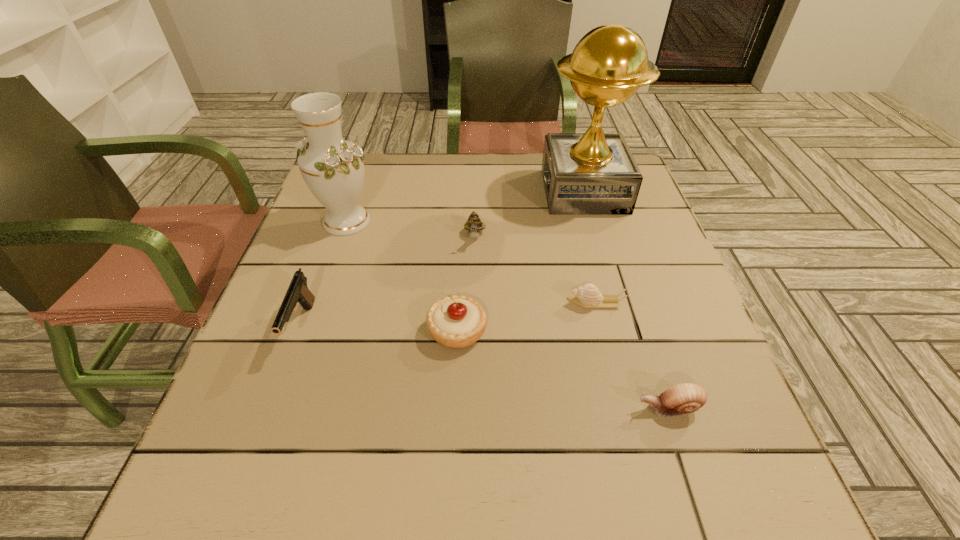
Image resolution: width=960 pixels, height=540 pixels. In order to click on vacant space located 0.270m on the front-facing side of the tallest object in this screenshot , I will do `click(443, 191)`.

This screenshot has width=960, height=540. Identify the location of blank space located on the front-facing side of the tallest object. (465, 191).

This screenshot has height=540, width=960. In order to click on free space located on the front-facing side of the tallest object in this screenshot , I will do `click(398, 191)`.

This screenshot has height=540, width=960. In order to click on vacant position located 0.170m on the right of the second tallest object in this screenshot , I will do `click(446, 221)`.

Locate an element on the screen. free space located 0.110m on the face of the tallest escargot is located at coordinates (474, 285).

You are a GUI agent. You are given a task and a screenshot of the screen. Output one action in this format:
    pyautogui.click(x=<x>, y=<y>)
    Task: Click on the vacant space located 0.160m at the muzzle of the pistol
    
    Given the screenshot: What is the action you would take?
    pyautogui.click(x=259, y=444)

Where is `vacant space located on the left of the pastry`? vacant space located on the left of the pastry is located at coordinates (268, 330).

Locate an element on the screen. The image size is (960, 540). vacant space located 0.180m on the front-facing side of the second shortest object is located at coordinates (529, 408).

Where is `free space located 0.080m on the front-facing side of the second shortest object`? The image size is (960, 540). free space located 0.080m on the front-facing side of the second shortest object is located at coordinates (588, 408).

The width and height of the screenshot is (960, 540). I want to click on vacant position located on the front-facing side of the second shortest object, so click(499, 408).